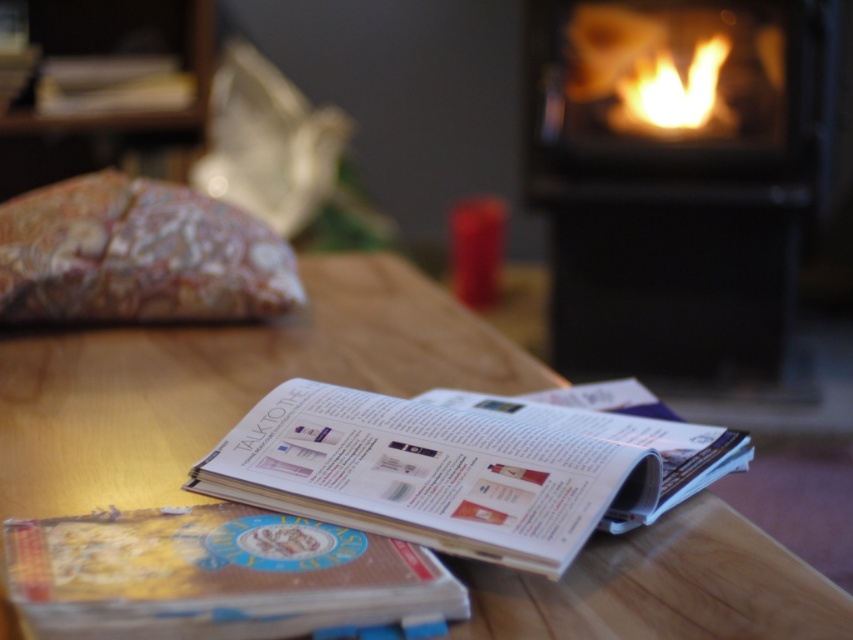
You are holding a remote control that needs to be placed on the wooden table at center. If the remote control is 7 inches long, will it fit on the table without hanging over the edge?

The wooden table at center has a distance of 19.34 inches from the viewer. Since the remote control is only 7 inches long, it will easily fit on the table without hanging over the edge.